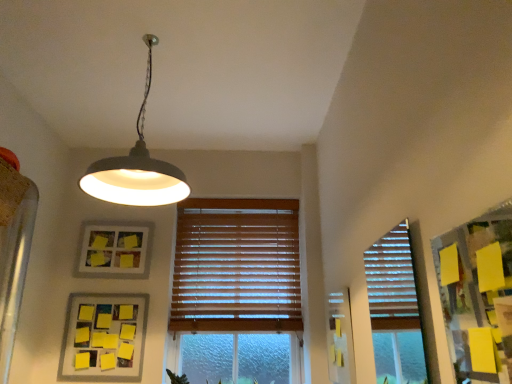
Question: Considering the positions of yellow matte picture frame at lower left, marked as the first picture frame in a bottom-to-top arrangement, and wooden blinds at center in the image, is yellow matte picture frame at lower left, marked as the first picture frame in a bottom-to-top arrangement, taller or shorter than wooden blinds at center?

Choices:
 (A) short
 (B) tall

Answer: (A)

Question: Looking at their shapes, would you say yellow matte picture frame at lower left, placed as the second picture frame when sorted from top to bottom, is wider or thinner than wooden blinds at center?

Choices:
 (A) thin
 (B) wide

Answer: (A)

Question: Estimate the real-world distances between objects in this image. Which object is closer to the yellow matte picture frame at upper left, placed as the 1th picture frame when sorted from back to front?

Choices:
 (A) wooden blinds at center
 (B) matte gray lampshade at upper center
 (C) yellow matte picture frame at lower left, which is the 2th picture frame from back to front

Answer: (C)

Question: Which is nearer to the yellow matte picture frame at lower left, marked as the first picture frame in a bottom-to-top arrangement?

Choices:
 (A) yellow matte picture frame at upper left, placed as the 1th picture frame when sorted from back to front
 (B) wooden blinds at center
 (C) matte gray lampshade at upper center

Answer: (A)